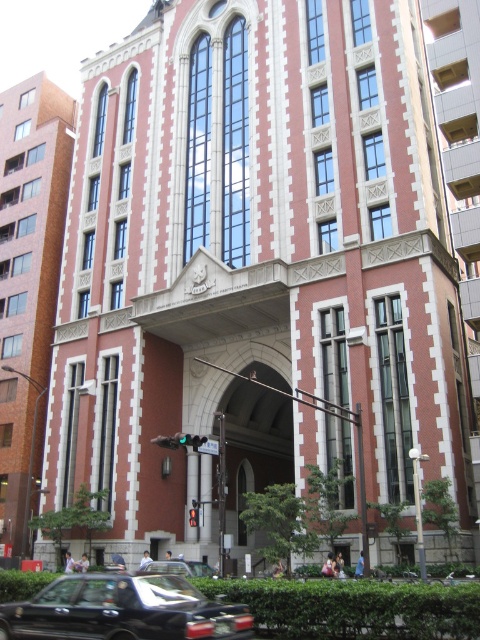
Is shiny black car at lower left in front of black glossy car at center?

Yes, shiny black car at lower left is in front of black glossy car at center.

From the picture: Does shiny black car at lower left have a greater width compared to black glossy car at center?

Indeed, shiny black car at lower left has a greater width compared to black glossy car at center.

This screenshot has width=480, height=640. What do you see at coordinates (122, 611) in the screenshot? I see `shiny black car at lower left` at bounding box center [122, 611].

You are a GUI agent. You are given a task and a screenshot of the screen. Output one action in this format:
    pyautogui.click(x=<x>, y=<y>)
    Task: Click on the shiny black car at lower left
    The height and width of the screenshot is (640, 480).
    Given the screenshot: What is the action you would take?
    pyautogui.click(x=122, y=611)